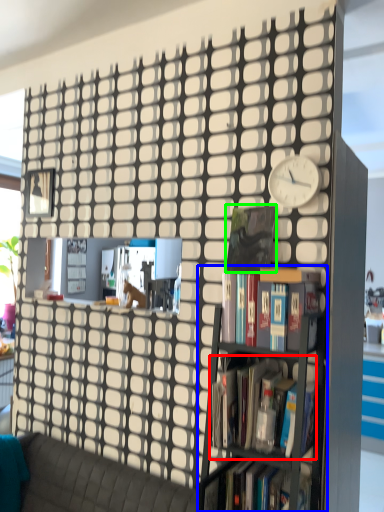
Question: Which object is positioned farthest from book (highlighted by a red box)? Select from bookcase (highlighted by a blue box) and paperback book (highlighted by a green box).

Choices:
 (A) bookcase
 (B) paperback book

Answer: (B)